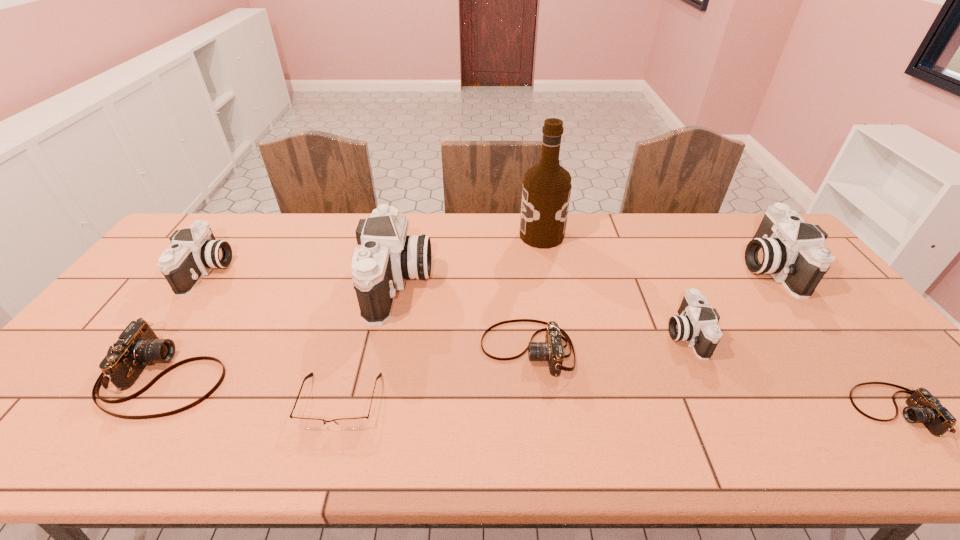
The image size is (960, 540). Identify the location of black camera that stands as the closest to the seventh tallest object. (388, 256).

Identify which brown camera is the closest to the third camera from right to left. Please provide its 2D coordinates. Your answer should be formatted as a tuple, i.e. [(x, y)], where the tuple contains the x and y coordinates of a point satisfying the conditions above.

[(552, 350)]

Identify which brown camera is the second nearest to the brown alcohol. Please provide its 2D coordinates. Your answer should be formatted as a tuple, i.e. [(x, y)], where the tuple contains the x and y coordinates of a point satisfying the conditions above.

[(923, 407)]

Where is `vacant area that satisfies the following two spatial constraints: 1. on the label of the second black camera from right to left; 2. on the right side of the tallest object`? The width and height of the screenshot is (960, 540). vacant area that satisfies the following two spatial constraints: 1. on the label of the second black camera from right to left; 2. on the right side of the tallest object is located at coordinates (560, 334).

The width and height of the screenshot is (960, 540). In order to click on vacant area in the image that satisfies the following two spatial constraints: 1. on the label of the fourth shortest camera; 2. on the left side of the tallest object in this screenshot , I will do 560,334.